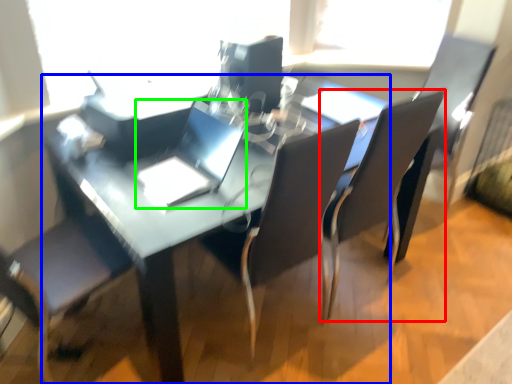
Question: Considering the real-world distances, which object is farthest from chair (highlighted by a red box)? table (highlighted by a blue box) or laptop (highlighted by a green box)?

Choices:
 (A) table
 (B) laptop

Answer: (B)